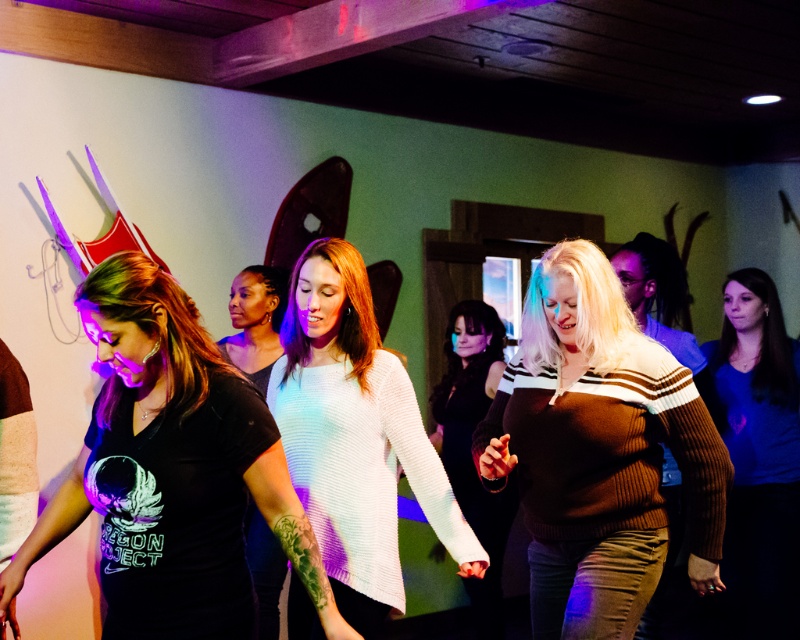
Does white knitted sweater at center come behind blue ribbed sweater at lower right?

No, it is not.

Is white knitted sweater at center to the left of blue ribbed sweater at lower right from the viewer's perspective?

Indeed, white knitted sweater at center is positioned on the left side of blue ribbed sweater at lower right.

Does point (432, 468) come behind point (794, 577)?

No, (432, 468) is closer to viewer.

Locate an element on the screen. Image resolution: width=800 pixels, height=640 pixels. white knitted sweater at center is located at coordinates (354, 436).

From the picture: Is black matte t-shirt at left positioned before knit sweater at center?

That is True.

Who is positioned more to the left, black matte t-shirt at left or knit sweater at center?

black matte t-shirt at left

Image resolution: width=800 pixels, height=640 pixels. Find the location of `black matte t-shirt at left`. black matte t-shirt at left is located at coordinates (172, 472).

Who is shorter, black matte t-shirt at left or blue ribbed sweater at lower right?

With less height is black matte t-shirt at left.

Identify the location of black matte t-shirt at left. Image resolution: width=800 pixels, height=640 pixels. (172, 472).

What do you see at coordinates (172, 472) in the screenshot? I see `black matte t-shirt at left` at bounding box center [172, 472].

In order to click on black matte t-shirt at left in this screenshot , I will do `click(172, 472)`.